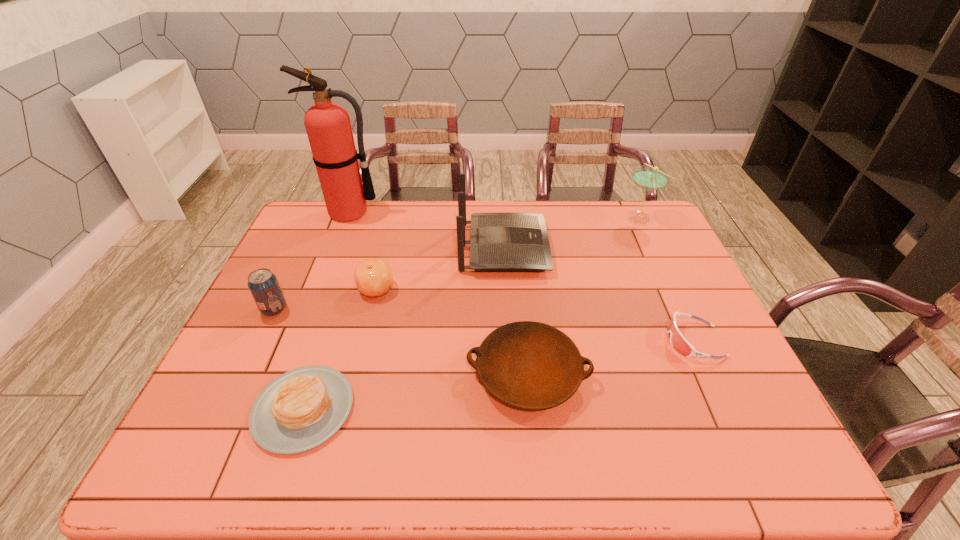
Locate an element on the screen. martini at the far edge is located at coordinates (649, 178).

Identify the location of object present at the near edge. Image resolution: width=960 pixels, height=540 pixels. (299, 410).

The width and height of the screenshot is (960, 540). Identify the location of fire extinguisher that is at the left edge. tap(328, 126).

Find the location of `pop soda at the left edge`. pop soda at the left edge is located at coordinates coord(262,283).

At what (x,y) coordinates should I click in order to perform the action: click on pancake that is at the left edge. Please return your answer as a coordinate pair (x, y). The image size is (960, 540). Looking at the image, I should click on (299, 410).

The height and width of the screenshot is (540, 960). I want to click on martini situated at the right edge, so click(649, 178).

Find the location of a particular element. goggles that is at the right edge is located at coordinates (679, 343).

You are a GUI agent. You are given a task and a screenshot of the screen. Output one action in this format:
    pyautogui.click(x=<x>, y=<y>)
    Task: Click on the object situated at the far left corner
    
    Given the screenshot: What is the action you would take?
    pyautogui.click(x=328, y=126)

The width and height of the screenshot is (960, 540). Find the location of `object that is at the near left corner`. object that is at the near left corner is located at coordinates (299, 410).

At what (x,y) coordinates should I click in order to perform the action: click on object at the far right corner. Please return your answer as a coordinate pair (x, y). The height and width of the screenshot is (540, 960). Looking at the image, I should click on (x=649, y=178).